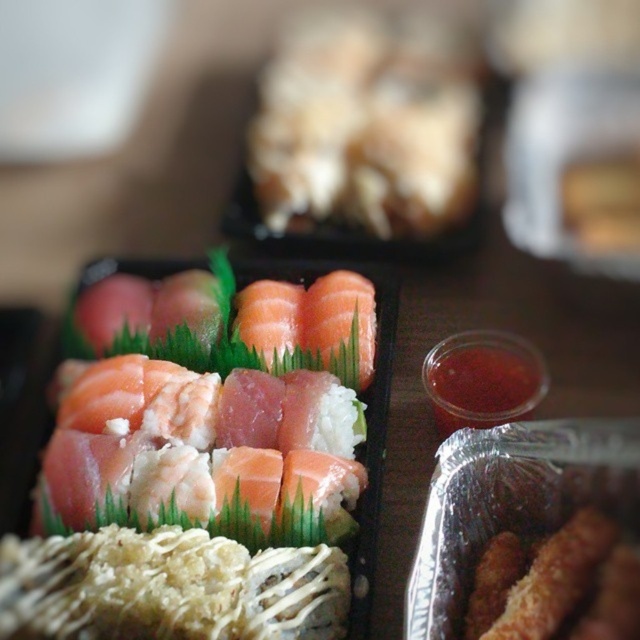
Question: Does pink raw fish at center have a larger size compared to slightly translucent salmon at upper center?

Choices:
 (A) yes
 (B) no

Answer: (A)

Question: Can you confirm if pink raw fish at center is positioned above slightly translucent salmon at upper center?

Choices:
 (A) no
 (B) yes

Answer: (A)

Question: Which object appears farthest from the camera in this image?

Choices:
 (A) slightly translucent salmon at upper center
 (B) pink raw fish at center

Answer: (A)

Question: Which of the following is the closest to the observer?

Choices:
 (A) slightly translucent salmon at upper center
 (B) pink raw fish at center

Answer: (B)

Question: Is pink raw fish at center bigger than slightly translucent salmon at upper center?

Choices:
 (A) no
 (B) yes

Answer: (B)